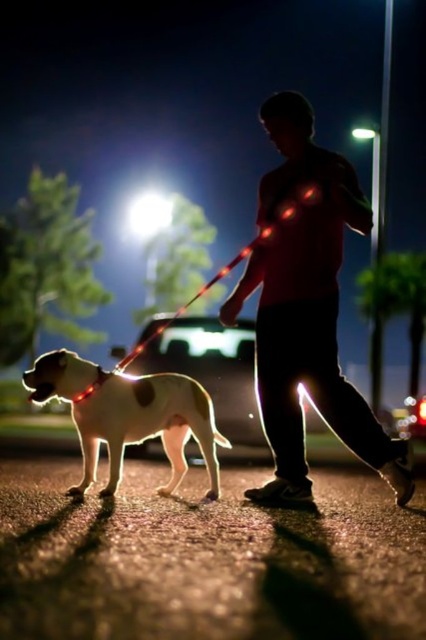
Question: Among these points, which one is farthest from the camera?

Choices:
 (A) (48, 362)
 (B) (396, 477)

Answer: (B)

Question: Is black matte shirt at center above shiny white dog at center?

Choices:
 (A) no
 (B) yes

Answer: (B)

Question: Which point is farther to the camera?

Choices:
 (A) black matte shirt at center
 (B) shiny white dog at center

Answer: (B)

Question: Is black matte shirt at center positioned in front of shiny white dog at center?

Choices:
 (A) yes
 (B) no

Answer: (A)

Question: In this image, where is black matte shirt at center located relative to shiny white dog at center?

Choices:
 (A) right
 (B) left

Answer: (A)

Question: Which of the following is the farthest from the observer?

Choices:
 (A) shiny white dog at center
 (B) black matte shirt at center

Answer: (A)